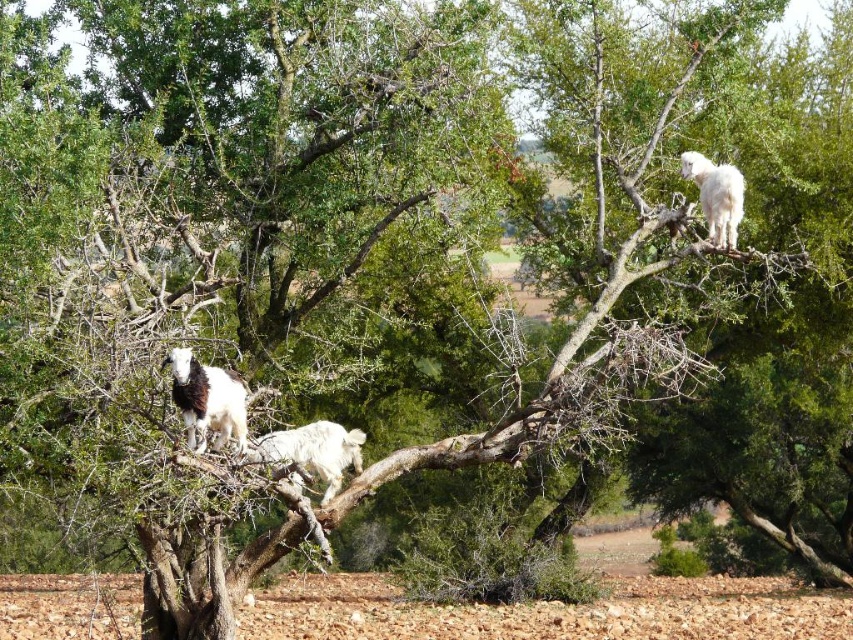
Is point (730, 605) in front of point (180, 358)?

No.

Who is positioned more to the right, dirt field at lower center or white woolen goat at left?

Positioned to the right is dirt field at lower center.

You are a GUI agent. You are given a task and a screenshot of the screen. Output one action in this format:
    pyautogui.click(x=<x>, y=<y>)
    Task: Click on the dirt field at lower center
    
    Given the screenshot: What is the action you would take?
    pyautogui.click(x=553, y=605)

Find the location of a particular element. The width and height of the screenshot is (853, 640). dirt field at lower center is located at coordinates (553, 605).

The width and height of the screenshot is (853, 640). Describe the element at coordinates (312, 451) in the screenshot. I see `white woolen sheep at center` at that location.

Can you confirm if white woolen sheep at center is thinner than white woolen goat at upper right?

No, white woolen sheep at center is not thinner than white woolen goat at upper right.

What do you see at coordinates (312, 451) in the screenshot? I see `white woolen sheep at center` at bounding box center [312, 451].

The height and width of the screenshot is (640, 853). What are the coordinates of `white woolen sheep at center` in the screenshot? It's located at (312, 451).

Between point (236, 449) and point (711, 195), which one is positioned behind?

Positioned behind is point (711, 195).

Is white woolen goat at left positioned in front of white woolen goat at upper right?

Yes, white woolen goat at left is in front of white woolen goat at upper right.

Where is `white woolen goat at left`? This screenshot has width=853, height=640. white woolen goat at left is located at coordinates (206, 401).

This screenshot has width=853, height=640. I want to click on white woolen goat at left, so click(206, 401).